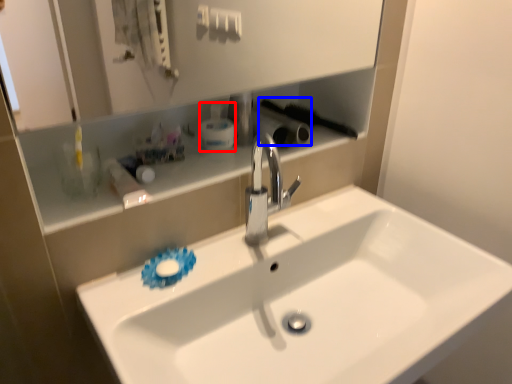
Question: Among these objects, which one is farthest to the camera, mouthwash (highlighted by a red box) or brush (highlighted by a blue box)?

Choices:
 (A) mouthwash
 (B) brush

Answer: (B)